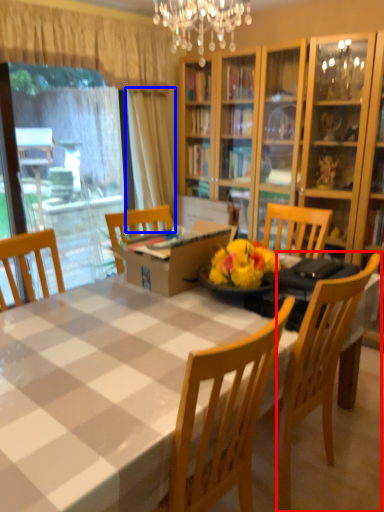
Question: Among these objects, which one is farthest to the camera, chair (highlighted by a red box) or curtain (highlighted by a blue box)?

Choices:
 (A) chair
 (B) curtain

Answer: (B)